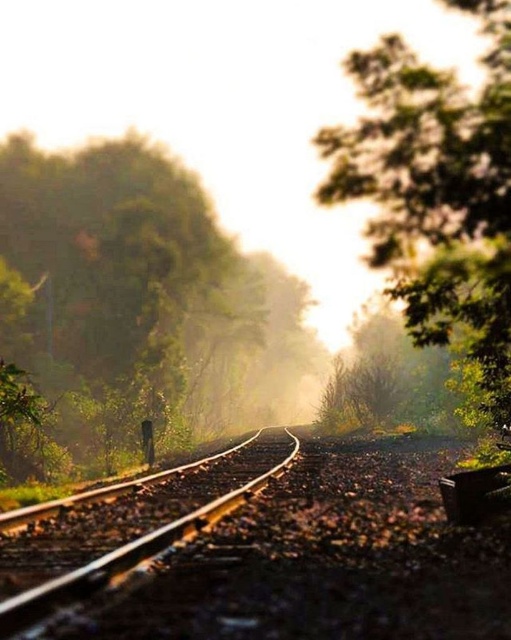
Question: Among these points, which one is nearest to the camera?

Choices:
 (A) [x=21, y=596]
 (B) [x=101, y=193]

Answer: (A)

Question: Based on their relative distances, which object is nearer to the green leafy tree at upper right?

Choices:
 (A) smooth metal train track at center
 (B) green leafy tree at left

Answer: (B)

Question: Is green leafy tree at left closer to camera compared to green leafy tree at upper right?

Choices:
 (A) no
 (B) yes

Answer: (A)

Question: Does green leafy tree at left appear on the left side of smooth metal train track at center?

Choices:
 (A) yes
 (B) no

Answer: (A)

Question: Does green leafy tree at left have a greater width compared to smooth metal train track at center?

Choices:
 (A) yes
 (B) no

Answer: (A)

Question: Which point is closer to the camera?

Choices:
 (A) (293, 436)
 (B) (165, 449)

Answer: (B)